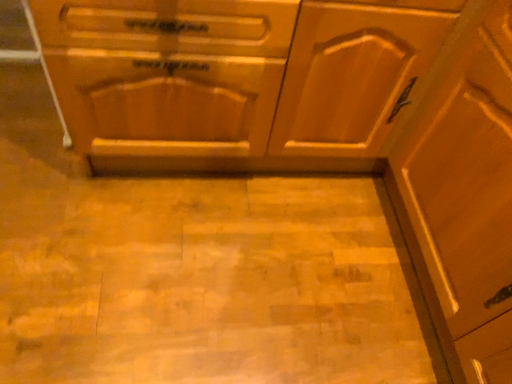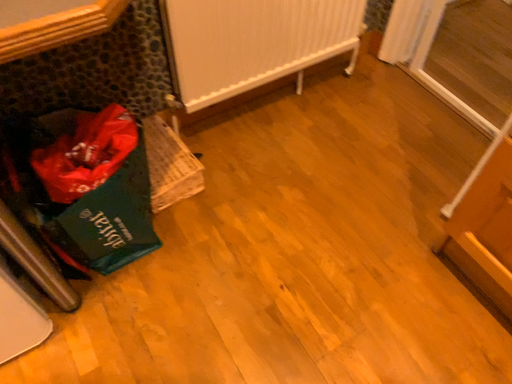
Question: Which way did the camera rotate in the video?

Choices:
 (A) rotated left
 (B) rotated right

Answer: (A)